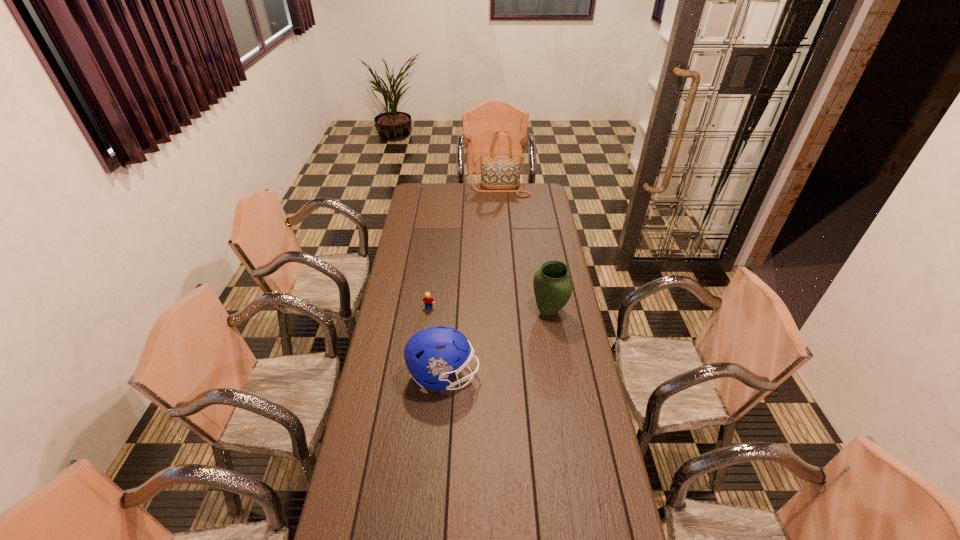
The width and height of the screenshot is (960, 540). What are the coordinates of `free area in between the shortest object and the farthest object` in the screenshot? It's located at (465, 249).

Locate which object ranks third in proximity to the Lego. Please provide its 2D coordinates. Your answer should be formatted as a tuple, i.e. [(x, y)], where the tuple contains the x and y coordinates of a point satisfying the conditions above.

[(500, 173)]

You are a GUI agent. You are given a task and a screenshot of the screen. Output one action in this format:
    pyautogui.click(x=<x>, y=<y>)
    Task: Click on the object that ranks as the second closest to the shortest object
    The image size is (960, 540).
    Given the screenshot: What is the action you would take?
    pyautogui.click(x=552, y=285)

Locate an element on the screen. free region that satisfies the following two spatial constraints: 1. on the front-facing side of the shortest object; 2. on the left side of the vase is located at coordinates (428, 312).

The width and height of the screenshot is (960, 540). Find the location of `vacant position in the image that satisfies the following two spatial constraints: 1. on the front-facing side of the farthest object; 2. on the right side of the vase`. vacant position in the image that satisfies the following two spatial constraints: 1. on the front-facing side of the farthest object; 2. on the right side of the vase is located at coordinates (508, 312).

Locate an element on the screen. Image resolution: width=960 pixels, height=540 pixels. vacant area in the image that satisfies the following two spatial constraints: 1. on the front-facing side of the farthest object; 2. on the face guard of the football helmet is located at coordinates click(513, 375).